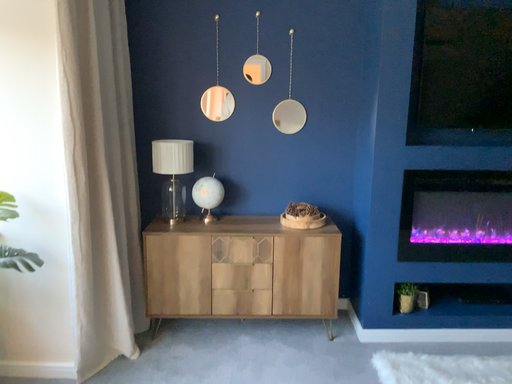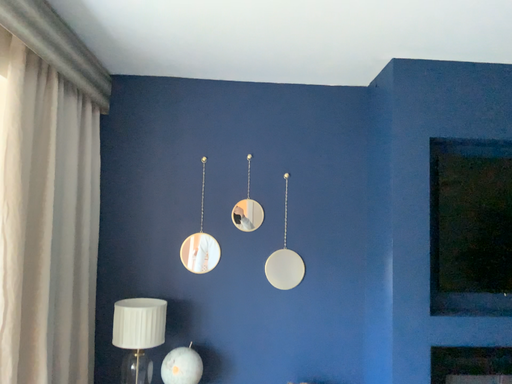
Question: How did the camera likely rotate when shooting the video?

Choices:
 (A) rotated downward
 (B) rotated upward

Answer: (B)